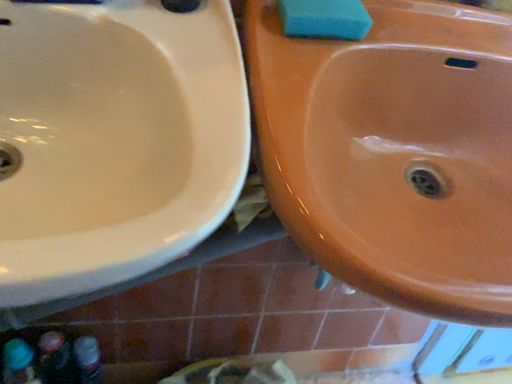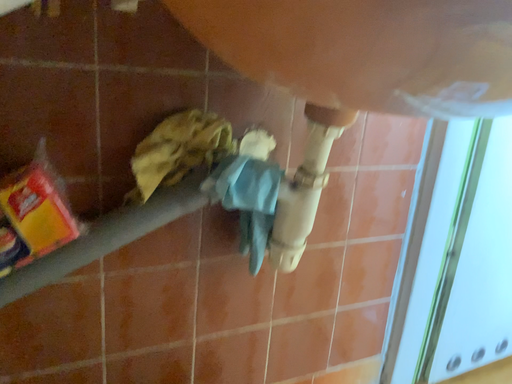
Question: Which way did the camera rotate in the video?

Choices:
 (A) rotated right
 (B) rotated left

Answer: (A)